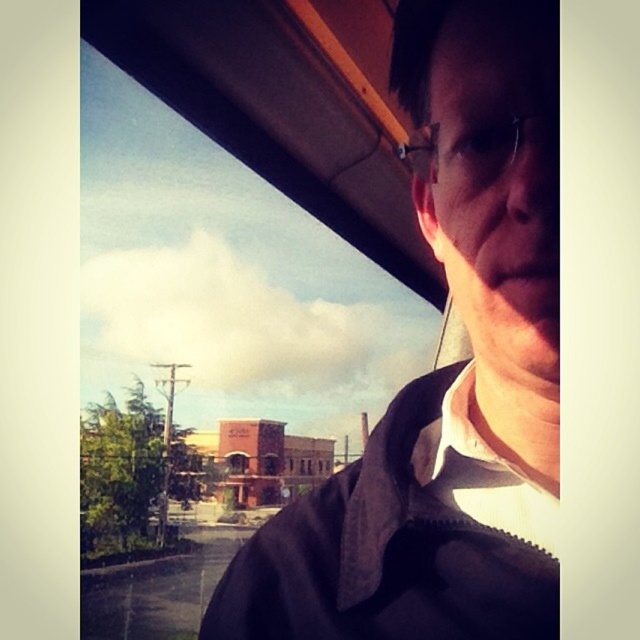
You are a passenger in the vehicle and want to check the brown fabric jacket at upper right. Based on the scene description, where exactly is the brown fabric jacket positioned relative to the window and the person?

The brown fabric jacket at upper right is located at point coordinates (444,369), which places it near the upper right corner of the window area, positioned above and to the right of the person.

Looking at this image, you are a tailor trying to determine if the clear plastic glasses at upper center can fit into the pocket of the brown fabric jacket at upper right. Based on their sizes, can the glasses fit?

The brown fabric jacket at upper right is wider than the clear plastic glasses at upper center, so the glasses can fit into the jacket pocket.

You are a tailor measuring the distance between the brown fabric jacket at upper right and the clear plastic glasses at upper center for a custom fitting. The minimum distance required for accurate measurements is 5 inches. Can you proceed with the current spacing?

The brown fabric jacket at upper right and clear plastic glasses at upper center are 5.12 inches apart, which exceeds the minimum required distance of 5 inches. Therefore, you can proceed with the current spacing for the custom fitting.